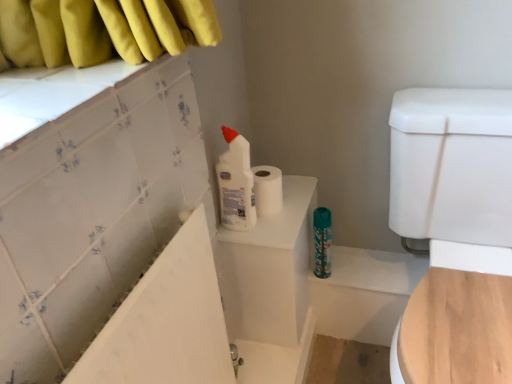
Where is `vacant point to the right of teal glossy water bottle at center`? vacant point to the right of teal glossy water bottle at center is located at coordinates (372, 267).